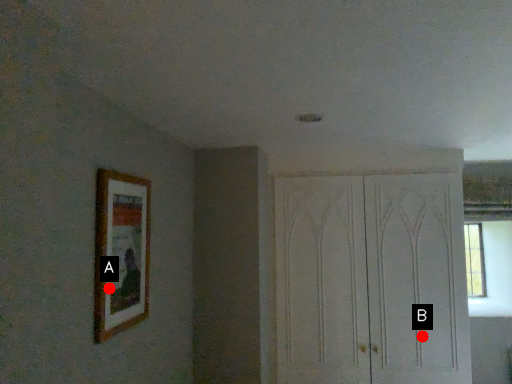
Question: Two points are circled on the image, labeled by A and B beside each circle. Which of the following is the farthest from the observer?

Choices:
 (A) A is further
 (B) B is further

Answer: (B)